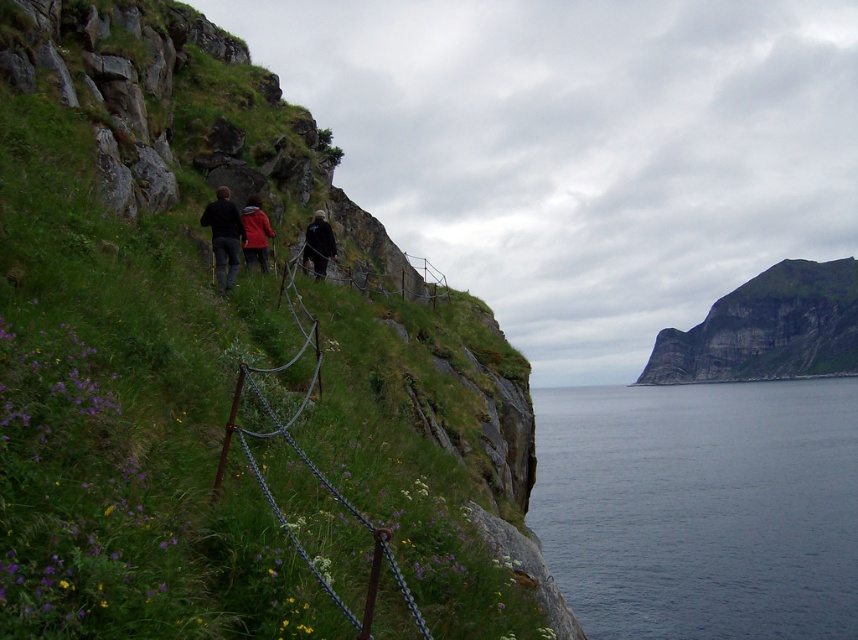
You are a hiker planning to take a photo of the rugged rock cliff at upper right and the green grassy hillside at upper left. Which one would you need to adjust your camera angle upwards to capture properly?

You would need to adjust your camera angle upwards to capture the rugged rock cliff at upper right because it is taller than the green grassy hillside at upper left.

Looking at this image, you are a hiker standing at the starting point of the coastal path. You see the green grassy hillside at upper left and the rugged rock cliff at upper right. Which of these two landmarks is closer to your current position?

The green grassy hillside at upper left is closer to your current position because it is in front of the rugged rock cliff at upper right.

You are a hiker standing on the coastal path. You see the blue water at lower right and the dark blue jacket at center. Which object is closer to the bottom edge of the image?

The blue water at lower right is positioned under the dark blue jacket at center, so it is closer to the bottom edge of the image.